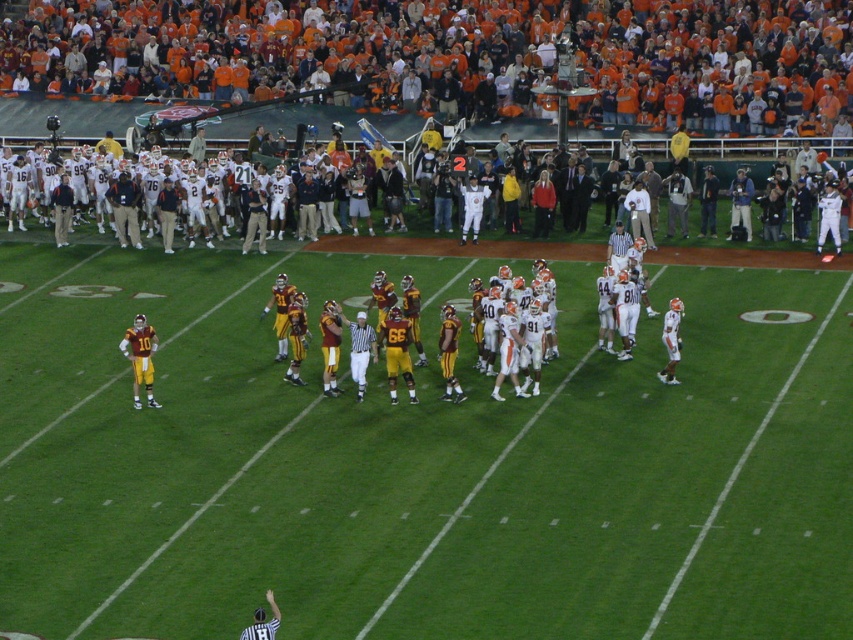
You are standing at the point labeled point (178, 24) on the football field. A teammate is approaching you from the direction of the opposing team. If you need to pass the ball to a teammate located 50 meters away from you, can you throw it directly to them without it going beyond the field boundary?

The point labeled point (178, 24) is 46.81 meters away from the viewer. Since the teammate is 50 meters away, the pass would exceed the distance between the point and the viewer, potentially going beyond the field boundary.

You are a photographer at the football game. You want to take a photo of the yellow uniformed players at center without the orange jersey fans at upper center appearing in the shot. Based on their positions, is this possible?

The orange jersey fans at upper center are to the right of the yellow uniformed players at center. Since they are positioned to the right, you can adjust your camera angle to the left side of the yellow uniformed players at center to exclude the orange jersey fans at upper center from the frame.